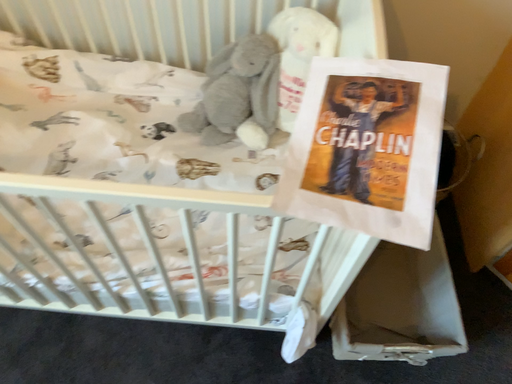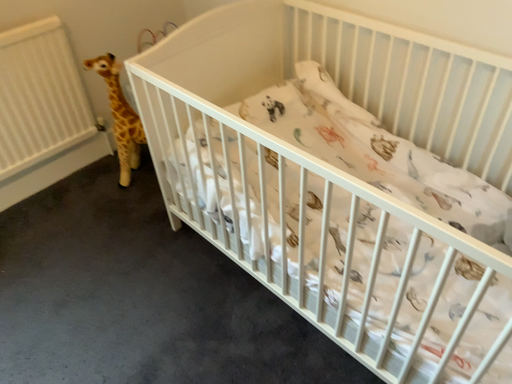
Question: Which way did the camera rotate in the video?

Choices:
 (A) rotated downward
 (B) rotated upward

Answer: (B)